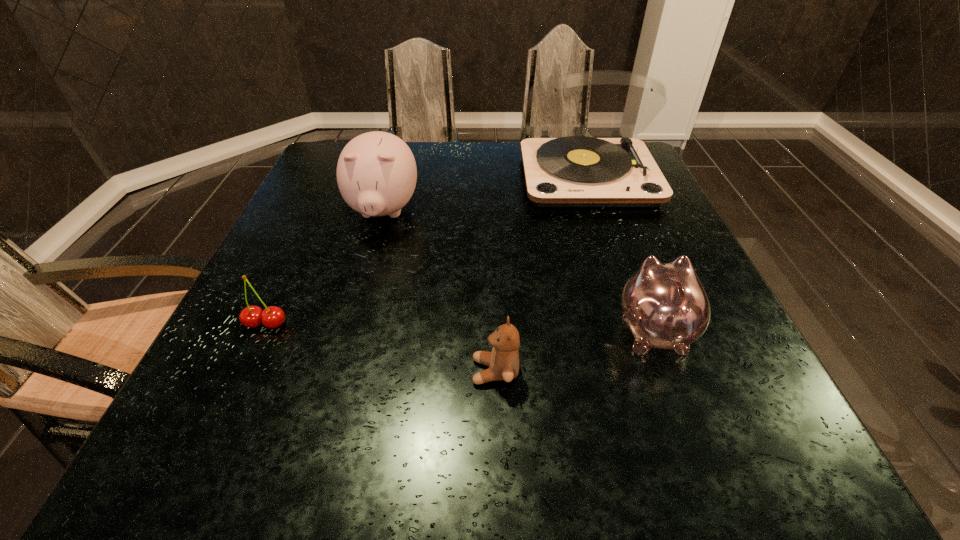
The height and width of the screenshot is (540, 960). Identify the location of record player. (576, 171).

The image size is (960, 540). Identify the location of the left piggy bank. (376, 172).

Where is `the second tallest object`? The width and height of the screenshot is (960, 540). the second tallest object is located at coordinates (376, 172).

I want to click on the shorter piggy bank, so click(x=665, y=305).

This screenshot has height=540, width=960. Find the location of `the nearer piggy bank`. the nearer piggy bank is located at coordinates (665, 305).

The width and height of the screenshot is (960, 540). Identify the location of teddy bear. (503, 362).

Identify the location of cherry. (x=272, y=317).

Where is `vacant space positioned with the tonearm facing the front of the record player`? The height and width of the screenshot is (540, 960). vacant space positioned with the tonearm facing the front of the record player is located at coordinates (612, 245).

The width and height of the screenshot is (960, 540). What are the coordinates of `free spot located at the snout of the second object from left to right` in the screenshot? It's located at (x=365, y=278).

Locate an element on the screen. The image size is (960, 540). free space located on the front facing side of the nearer piggy bank is located at coordinates tap(601, 190).